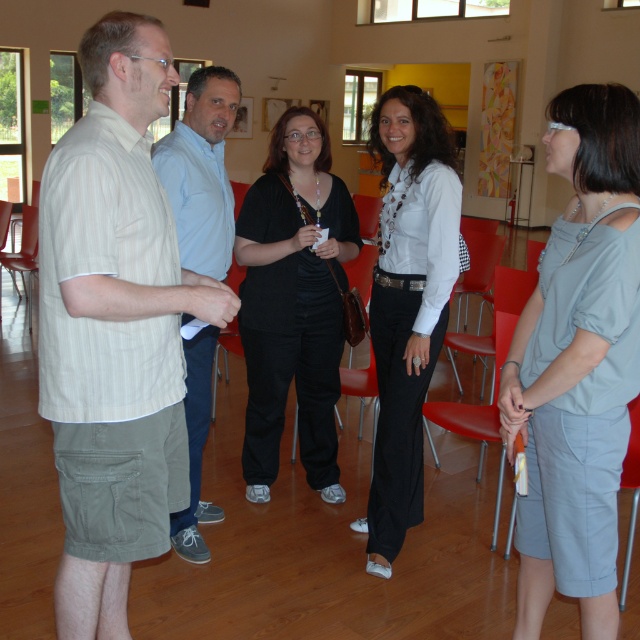
Question: Estimate the real-world distances between objects in this image. Which object is farther from the white glossy shirt at center?

Choices:
 (A) black matte shirt at center
 (B) matte plastic chair at lower left
 (C) light blue shirt at center
 (D) light beige striped shirt at left

Answer: (B)

Question: Which of the following is the farthest from the observer?

Choices:
 (A) tap(132, 122)
 (B) tap(515, 500)
 (C) tap(310, 390)

Answer: (C)

Question: Does light blue fabric skirt at lower right have a lesser width compared to matte plastic chair at lower left?

Choices:
 (A) no
 (B) yes

Answer: (B)

Question: Which of these objects is positioned closest to the matte plastic chair at lower left?

Choices:
 (A) black matte shirt at center
 (B) light blue shirt at center

Answer: (A)

Question: Can you confirm if black matte shirt at center is thinner than white glossy shirt at center?

Choices:
 (A) yes
 (B) no

Answer: (B)

Question: Is light gray fabric dress at center to the right of white glossy shirt at center from the viewer's perspective?

Choices:
 (A) no
 (B) yes

Answer: (B)